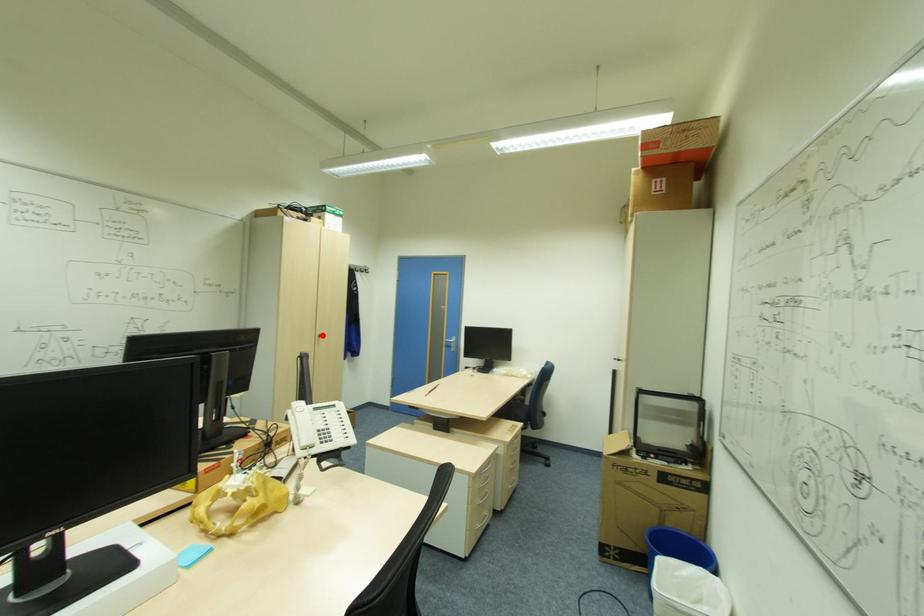
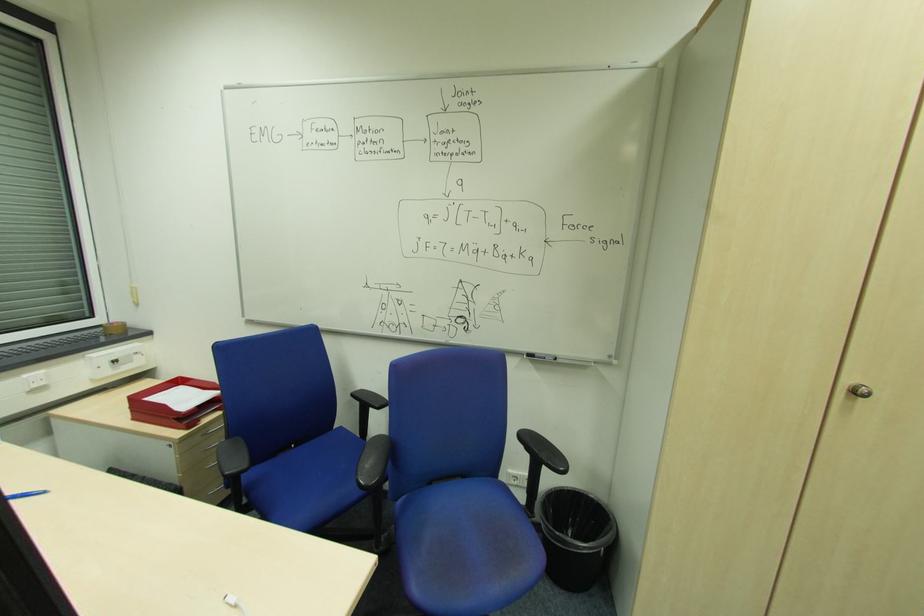
The point at the highlighted location is marked in the first image. Where is the corresponding point in the second image?

(860, 392)